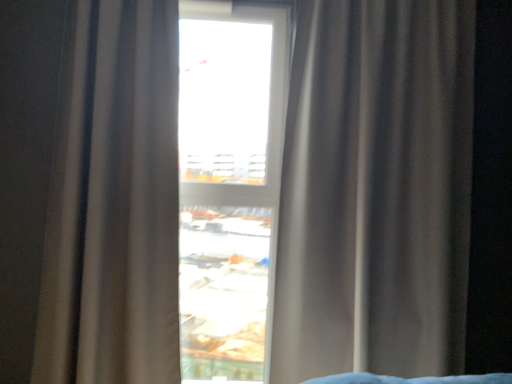
Image resolution: width=512 pixels, height=384 pixels. Describe the element at coordinates (375, 190) in the screenshot. I see `satin beige curtain at center, arranged as the 2th curtain when viewed from the left` at that location.

Describe the element at coordinates (114, 202) in the screenshot. The height and width of the screenshot is (384, 512). I see `satin beige curtain at center, the second curtain viewed from the right` at that location.

Where is `satin beige curtain at center, arranged as the 2th curtain when viewed from the left`? satin beige curtain at center, arranged as the 2th curtain when viewed from the left is located at coordinates (375, 190).

Measure the distance between transparent glass window at center and satin beige curtain at center, which is the 1th curtain from right to left.

transparent glass window at center and satin beige curtain at center, which is the 1th curtain from right to left, are 22.12 inches apart.

From the image's perspective, relative to satin beige curtain at center, arranged as the 2th curtain when viewed from the left, is transparent glass window at center above or below?

Based on their image positions, transparent glass window at center is located beneath satin beige curtain at center, arranged as the 2th curtain when viewed from the left.

Which of these two, transparent glass window at center or satin beige curtain at center, which is the 1th curtain from right to left, stands taller?

With more height is transparent glass window at center.

You are a GUI agent. You are given a task and a screenshot of the screen. Output one action in this format:
    pyautogui.click(x=<x>, y=<y>)
    Task: Click on the window lying on the left of satin beige curtain at center, which is the 1th curtain from right to left
    The image size is (512, 384).
    Given the screenshot: What is the action you would take?
    pyautogui.click(x=229, y=184)

From the image's perspective, which one is positioned higher, satin beige curtain at center, which is the 1th curtain from right to left, or satin beige curtain at center, the second curtain viewed from the right?

satin beige curtain at center, the second curtain viewed from the right, appears higher in the image.

Does satin beige curtain at center, which is the 1th curtain from right to left, come behind satin beige curtain at center, which appears as the 1th curtain when viewed from the left?

That is True.

Does satin beige curtain at center, arranged as the 2th curtain when viewed from the left, have a lesser height compared to satin beige curtain at center, the second curtain viewed from the right?

In fact, satin beige curtain at center, arranged as the 2th curtain when viewed from the left, may be taller than satin beige curtain at center, the second curtain viewed from the right.

Can you tell me how much satin beige curtain at center, arranged as the 2th curtain when viewed from the left, and transparent glass window at center differ in facing direction?

The angle between the facing direction of satin beige curtain at center, arranged as the 2th curtain when viewed from the left, and the facing direction of transparent glass window at center is 0.155 degrees.

Is transparent glass window at center at the back of satin beige curtain at center, arranged as the 2th curtain when viewed from the left?

No, transparent glass window at center is not at the back of satin beige curtain at center, arranged as the 2th curtain when viewed from the left.

From the image's perspective, which curtain is the 1st one above the transparent glass window at center? Please provide its 2D coordinates.

[(375, 190)]

Which object is positioned more to the right, satin beige curtain at center, which is the 1th curtain from right to left, or transparent glass window at center?

Positioned to the right is satin beige curtain at center, which is the 1th curtain from right to left.

Between satin beige curtain at center, which appears as the 1th curtain when viewed from the left, and satin beige curtain at center, arranged as the 2th curtain when viewed from the left, which one has less height?

With less height is satin beige curtain at center, which appears as the 1th curtain when viewed from the left.

From the image's perspective, is satin beige curtain at center, the second curtain viewed from the right, on satin beige curtain at center, arranged as the 2th curtain when viewed from the left?

Yes, from the image's perspective, satin beige curtain at center, the second curtain viewed from the right, is above satin beige curtain at center, arranged as the 2th curtain when viewed from the left.

In terms of size, does satin beige curtain at center, which appears as the 1th curtain when viewed from the left, appear bigger or smaller than satin beige curtain at center, which is the 1th curtain from right to left?

In the image, satin beige curtain at center, which appears as the 1th curtain when viewed from the left, appears to be smaller than satin beige curtain at center, which is the 1th curtain from right to left.

Who is more distant, transparent glass window at center or satin beige curtain at center, the second curtain viewed from the right?

transparent glass window at center is behind.

How different are the orientations of transparent glass window at center and satin beige curtain at center, which appears as the 1th curtain when viewed from the left, in degrees?

0.178 degrees.

How far apart are transparent glass window at center and satin beige curtain at center, which appears as the 1th curtain when viewed from the left?

transparent glass window at center is 21.19 inches from satin beige curtain at center, which appears as the 1th curtain when viewed from the left.

Between transparent glass window at center and satin beige curtain at center, which appears as the 1th curtain when viewed from the left, which one has less height?

satin beige curtain at center, which appears as the 1th curtain when viewed from the left, is shorter.

Which is more to the left, satin beige curtain at center, the second curtain viewed from the right, or transparent glass window at center?

satin beige curtain at center, the second curtain viewed from the right.

Is satin beige curtain at center, the second curtain viewed from the right, thinner than transparent glass window at center?

In fact, satin beige curtain at center, the second curtain viewed from the right, might be wider than transparent glass window at center.

Considering the positions of points (146, 152) and (227, 116), is point (146, 152) closer to camera compared to point (227, 116)?

Yes, point (146, 152) is in front of point (227, 116).

Would you say satin beige curtain at center, which appears as the 1th curtain when viewed from the left, is inside or outside transparent glass window at center?

The correct answer is: outside.

I want to click on window below the satin beige curtain at center, which is the 1th curtain from right to left (from the image's perspective), so click(229, 184).

Where is `curtain located on the right of satin beige curtain at center, the second curtain viewed from the right`? curtain located on the right of satin beige curtain at center, the second curtain viewed from the right is located at coordinates (375, 190).

When comparing their distances from transparent glass window at center, does satin beige curtain at center, the second curtain viewed from the right, or satin beige curtain at center, which is the 1th curtain from right to left, seem further?

Based on the image, satin beige curtain at center, which is the 1th curtain from right to left, appears to be further to transparent glass window at center.

Looking at the image, which one is located closer to transparent glass window at center, satin beige curtain at center, which is the 1th curtain from right to left, or satin beige curtain at center, which appears as the 1th curtain when viewed from the left?

satin beige curtain at center, which appears as the 1th curtain when viewed from the left.

Looking at the image, which one is located further to satin beige curtain at center, arranged as the 2th curtain when viewed from the left, transparent glass window at center or satin beige curtain at center, the second curtain viewed from the right?

Among the two, satin beige curtain at center, the second curtain viewed from the right, is located further to satin beige curtain at center, arranged as the 2th curtain when viewed from the left.

When comparing their distances from satin beige curtain at center, which appears as the 1th curtain when viewed from the left, does satin beige curtain at center, which is the 1th curtain from right to left, or transparent glass window at center seem further?

The object further to satin beige curtain at center, which appears as the 1th curtain when viewed from the left, is satin beige curtain at center, which is the 1th curtain from right to left.

Looking at the image, which one is located closer to satin beige curtain at center, which is the 1th curtain from right to left, satin beige curtain at center, which appears as the 1th curtain when viewed from the left, or transparent glass window at center?

transparent glass window at center lies closer to satin beige curtain at center, which is the 1th curtain from right to left, than the other object.

Which object lies further to the anchor point satin beige curtain at center, which appears as the 1th curtain when viewed from the left, transparent glass window at center or satin beige curtain at center, which is the 1th curtain from right to left?

Among the two, satin beige curtain at center, which is the 1th curtain from right to left, is located further to satin beige curtain at center, which appears as the 1th curtain when viewed from the left.

This screenshot has height=384, width=512. Identify the location of window between satin beige curtain at center, which appears as the 1th curtain when viewed from the left, and satin beige curtain at center, arranged as the 2th curtain when viewed from the left. (229, 184).